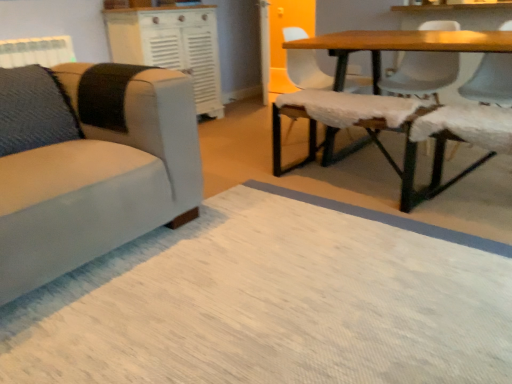
Question: Is fuzzy fabric swivel chair at center smaller than smooth white chair at upper right, which is the 1th chair in right-to-left order?

Choices:
 (A) no
 (B) yes

Answer: (A)

Question: Are fuzzy fabric swivel chair at center and smooth white chair at upper right, which is the 5th chair in left-to-right order, located far from each other?

Choices:
 (A) yes
 (B) no

Answer: (B)

Question: Is fuzzy fabric swivel chair at center beside smooth white chair at upper right, which is the 5th chair in left-to-right order?

Choices:
 (A) yes
 (B) no

Answer: (B)

Question: Is fuzzy fabric swivel chair at center to the left of smooth white chair at upper right, which is the 1th chair in right-to-left order, from the viewer's perspective?

Choices:
 (A) yes
 (B) no

Answer: (A)

Question: Does fuzzy fabric swivel chair at center have a larger size compared to smooth white chair at upper right, which is the 5th chair in left-to-right order?

Choices:
 (A) no
 (B) yes

Answer: (B)

Question: From a real-world perspective, is white fabric chair at upper right, the fourth chair from the left, positioned above or below white fabric chair at upper right, which appears as the 2th chair when viewed from the left?

Choices:
 (A) below
 (B) above

Answer: (A)

Question: In terms of width, does white fabric chair at upper right, the fourth chair from the left, look wider or thinner when compared to white fabric chair at upper right, which appears as the 2th chair when viewed from the left?

Choices:
 (A) thin
 (B) wide

Answer: (B)

Question: Considering their positions, is white fabric chair at upper right, the second chair positioned from the right, located in front of or behind white fabric chair at upper right, which appears as the 2th chair when viewed from the left?

Choices:
 (A) behind
 (B) front

Answer: (B)

Question: Is point (443, 76) positioned closer to the camera than point (321, 72)?

Choices:
 (A) farther
 (B) closer

Answer: (B)

Question: Is suede beige chair at left, marked as the first chair in a left-to-right arrangement, wider or thinner than fuzzy fabric swivel chair at center?

Choices:
 (A) thin
 (B) wide

Answer: (B)

Question: Considering the positions of suede beige chair at left, marked as the first chair in a left-to-right arrangement, and fuzzy fabric swivel chair at center in the image, is suede beige chair at left, marked as the first chair in a left-to-right arrangement, taller or shorter than fuzzy fabric swivel chair at center?

Choices:
 (A) tall
 (B) short

Answer: (A)

Question: From a real-world perspective, relative to fuzzy fabric swivel chair at center, is suede beige chair at left, placed as the 5th chair when sorted from right to left, vertically above or below?

Choices:
 (A) above
 (B) below

Answer: (A)

Question: From the image's perspective, is suede beige chair at left, placed as the 5th chair when sorted from right to left, positioned above or below fuzzy fabric swivel chair at center?

Choices:
 (A) above
 (B) below

Answer: (B)

Question: Based on their positions, is white textured cabinet at upper center located to the left or right of fuzzy fabric swivel chair at center?

Choices:
 (A) right
 (B) left

Answer: (B)

Question: From a real-world perspective, is white textured cabinet at upper center above or below fuzzy fabric swivel chair at center?

Choices:
 (A) below
 (B) above

Answer: (B)